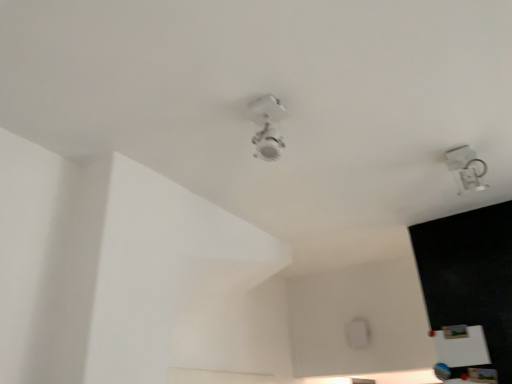
Question: Is transparent plastic lamp at upper right, which is the second lamp from front to back, spatially inside white glossy ceiling light at center, marked as the second lamp in a back-to-front arrangement, or outside of it?

Choices:
 (A) inside
 (B) outside

Answer: (B)

Question: Considering the positions of point (458, 145) and point (266, 110), is point (458, 145) closer or farther from the camera than point (266, 110)?

Choices:
 (A) closer
 (B) farther

Answer: (B)

Question: Considering the relative positions of transparent plastic lamp at upper right, positioned as the 2th lamp in left-to-right order, and white glossy ceiling light at center, the first lamp when ordered from front to back, in the image provided, is transparent plastic lamp at upper right, positioned as the 2th lamp in left-to-right order, to the left or to the right of white glossy ceiling light at center, the first lamp when ordered from front to back,?

Choices:
 (A) right
 (B) left

Answer: (A)

Question: Considering their positions, is white glossy ceiling light at center, the first lamp when ordered from front to back, located in front of or behind transparent plastic lamp at upper right, arranged as the first lamp when viewed from the right?

Choices:
 (A) front
 (B) behind

Answer: (A)

Question: Is white glossy ceiling light at center, the first lamp positioned from the left, wider or thinner than transparent plastic lamp at upper right, positioned as the 2th lamp in left-to-right order?

Choices:
 (A) thin
 (B) wide

Answer: (A)

Question: Is white glossy ceiling light at center, the 2th lamp positioned from the right, taller or shorter than transparent plastic lamp at upper right, positioned as the 2th lamp in left-to-right order?

Choices:
 (A) tall
 (B) short

Answer: (B)

Question: Is white glossy ceiling light at center, the first lamp when ordered from front to back, inside or outside of transparent plastic lamp at upper right, which is the second lamp from front to back?

Choices:
 (A) inside
 (B) outside

Answer: (B)